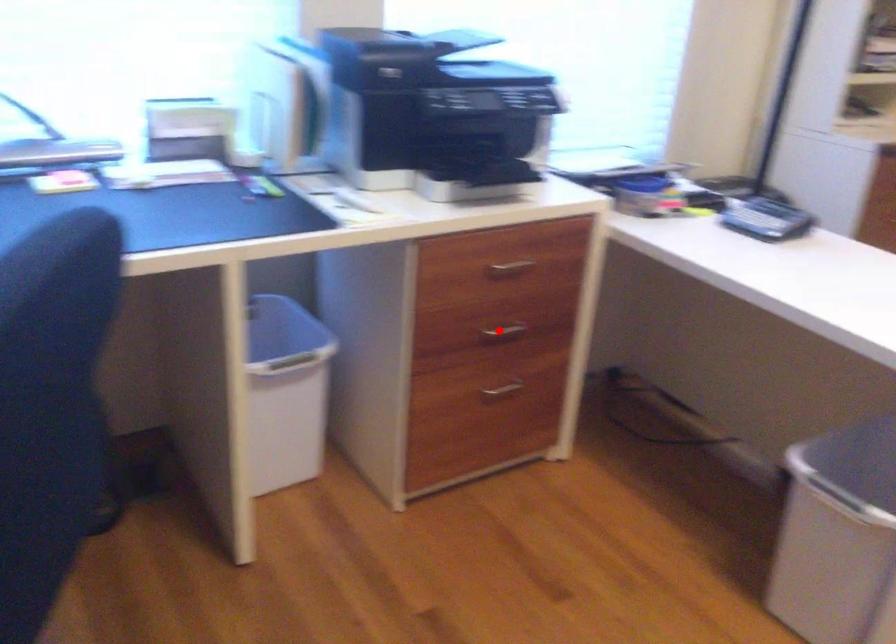
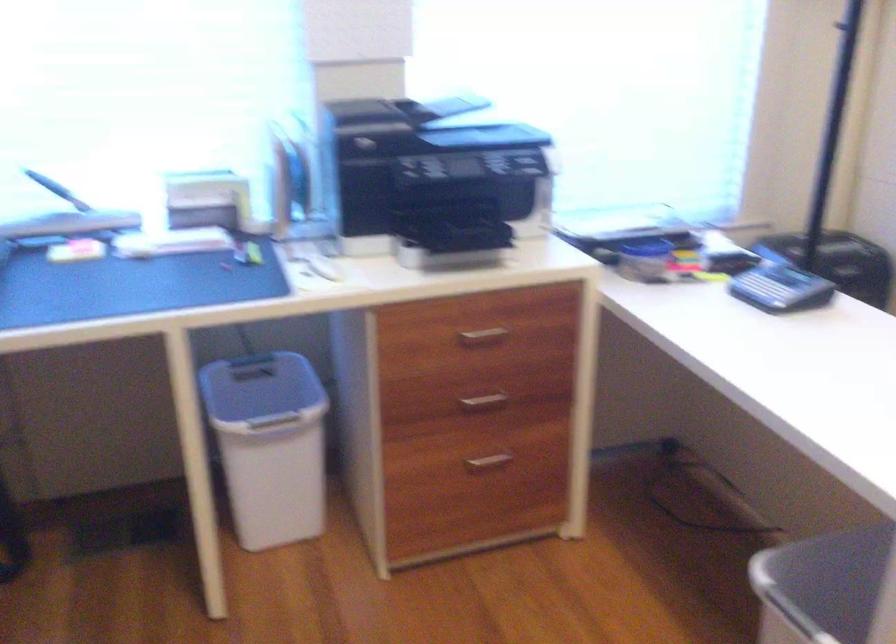
Locate, in the second image, the point that corresponds to the highlighted location in the first image.

(484, 401)